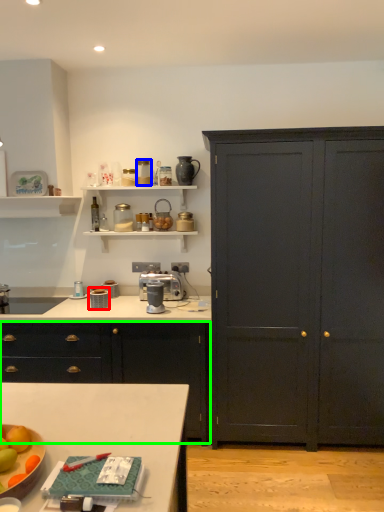
Question: Which object is positioned closest to appliance (highlighted by a red box)? Select from appliance (highlighted by a blue box) and cabinetry (highlighted by a green box).

Choices:
 (A) appliance
 (B) cabinetry

Answer: (B)